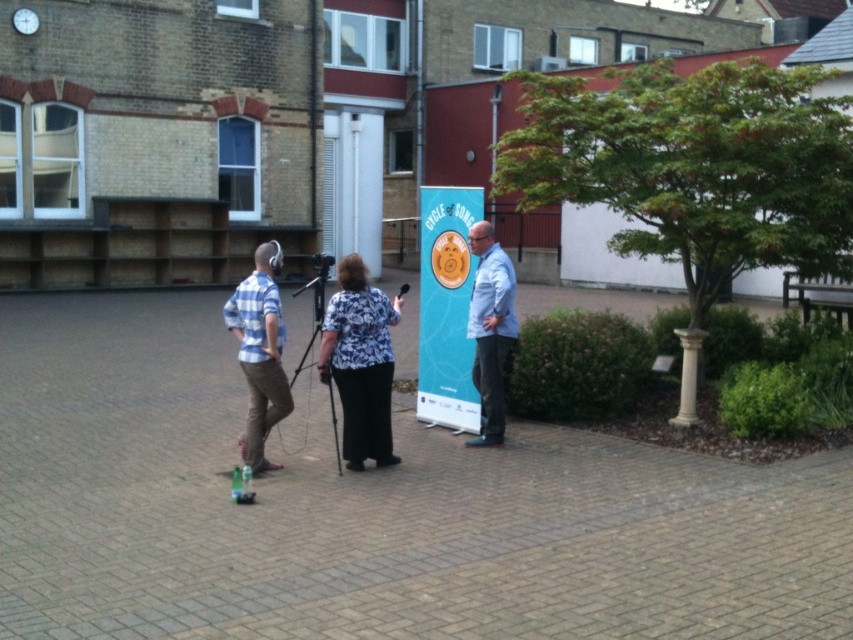
You are a photographer setting up for an event. You need to position a camera stand that can accommodate the width of both the plaid shirt at left and the blue shirt at center. Which shirt requires a wider camera stand setup?

The blue shirt at center requires a wider camera stand setup because its width is greater than the plaid shirt at left.

You are organizing a photo shoot and need to ensure that the floral blouse at center and the blue shirt at center are visible in the frame. Given that the camera has a maximum width capacity of 1.2 meters, can both items be accommodated within the frame?

The floral blouse at center is wider than the blue shirt at center. Since the camera can only accommodate up to 1.2 meters, it depends on the combined width of both items. However, the description only provides a comparison between their widths, not their exact measurements. Without knowing the exact width of either item, it is impossible to determine if they can fit within the camera frame.

You are a photographer standing at the back of the courtyard. You want to take a photo of both the floral blouse at center and the blue shirt at center in the same frame. Given that your camera has a minimum focus distance of 1 meter, can you capture both subjects clearly?

The floral blouse at center and blue shirt at center are 1.01 meters apart from each other. Since the distance between them exceeds the camera minimum focus distance of 1 meter, the photographer can capture both subjects clearly in the same frame.